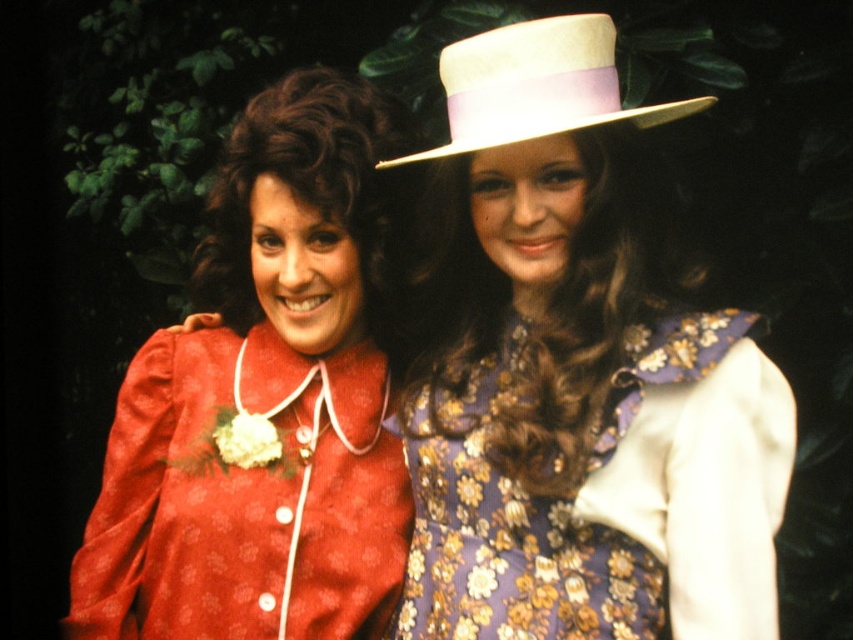
From the picture: Does matte red dress at left have a lesser width compared to floral-patterned fabric dress at center?

No.

Between matte red dress at left and floral-patterned fabric dress at center, which one is positioned higher?

matte red dress at left is higher up.

This screenshot has width=853, height=640. In order to click on matte red dress at left in this screenshot , I will do `click(263, 403)`.

Does matte red jacket at center have a greater height compared to floral-patterned fabric dress at center?

Yes.

Who is taller, matte red jacket at center or floral-patterned fabric dress at center?

matte red jacket at center is taller.

Locate an element on the screen. Image resolution: width=853 pixels, height=640 pixels. matte red jacket at center is located at coordinates (576, 372).

Can you confirm if matte red jacket at center is positioned to the left of white felt hat at upper center?

In fact, matte red jacket at center is to the right of white felt hat at upper center.

Between matte red jacket at center and white felt hat at upper center, which one has less height?

With less height is white felt hat at upper center.

Find the location of a particular element. matte red jacket at center is located at coordinates (576, 372).